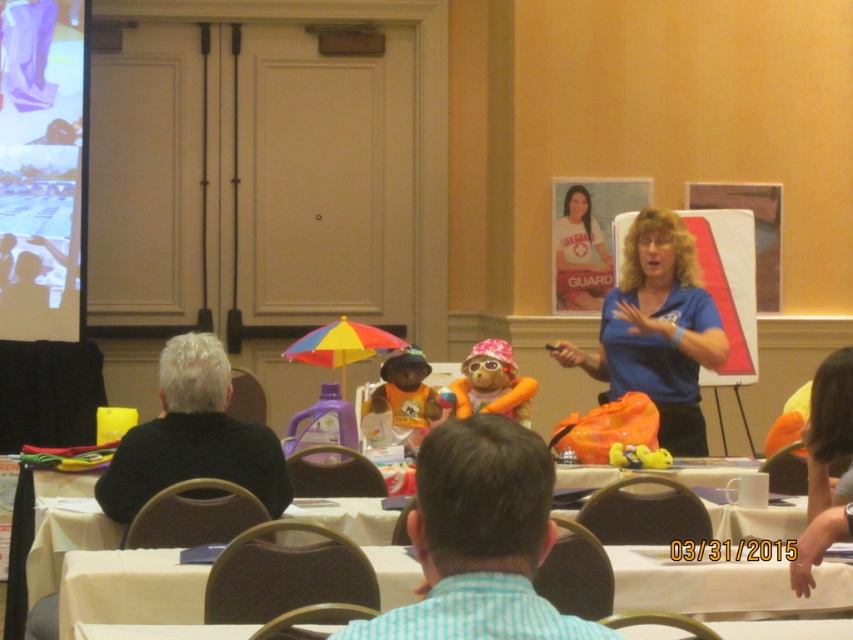
Question: Is white tablecloth at center wider than blue fabric shirt at center?

Choices:
 (A) yes
 (B) no

Answer: (B)

Question: Which of the following is the farthest from the observer?

Choices:
 (A) orange plush bear at center
 (B) blue striped shirt at center

Answer: (A)

Question: Which point is closer to the camera taking this photo?

Choices:
 (A) (0, 339)
 (B) (514, 417)
 (C) (572, 198)
 (D) (387, 401)

Answer: (B)

Question: Can you confirm if matte plastic screen at upper left is positioned to the right of plush orange monkey at center?

Choices:
 (A) yes
 (B) no

Answer: (B)

Question: Among these points, which one is farthest from the camera?

Choices:
 (A) click(451, 564)
 (B) click(67, 296)
 (C) click(410, 392)
 (D) click(90, 577)

Answer: (B)

Question: Is blue fabric shirt at center thinner than rainbow fabric umbrella at center?

Choices:
 (A) no
 (B) yes

Answer: (A)